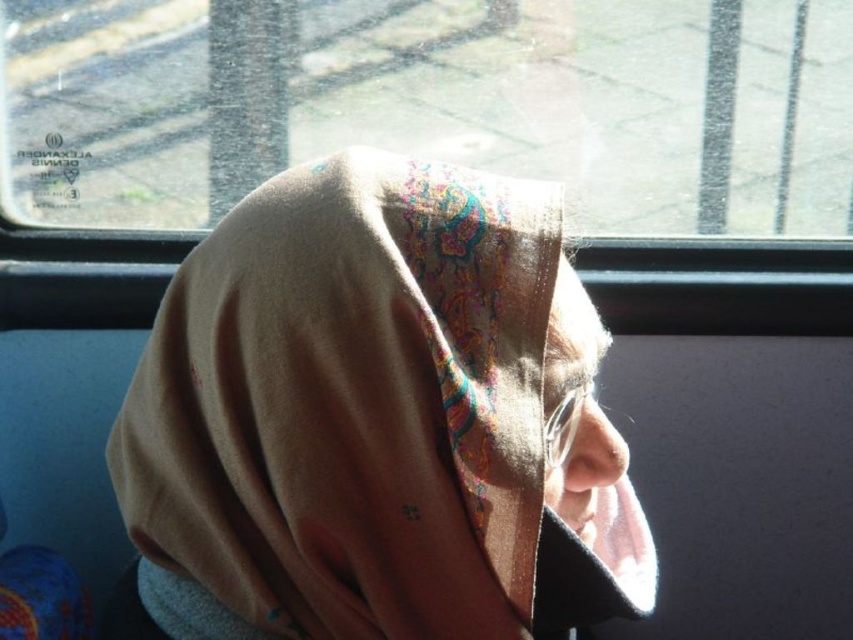
Does beige fabric headscarf at center come in front of transparent glass at upper center?

That is True.

Consider the image. Who is more forward, (114, 449) or (610, 0)?

Point (114, 449)

Which is in front, point (264, 605) or point (334, 122)?

Point (264, 605)

Locate an element on the screen. The image size is (853, 640). beige fabric headscarf at center is located at coordinates (378, 419).